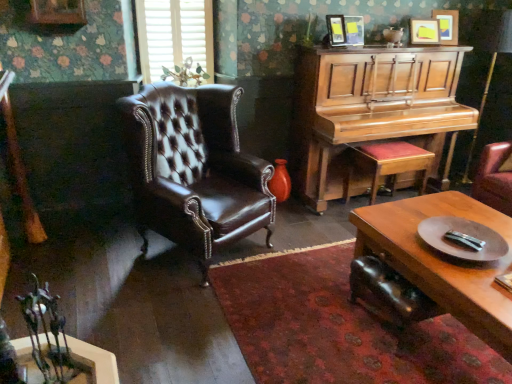
What do you see at coordinates (443, 260) in the screenshot?
I see `wooden polished coffee table at lower right` at bounding box center [443, 260].

Image resolution: width=512 pixels, height=384 pixels. What do you see at coordinates (447, 25) in the screenshot?
I see `matte wooden picture frame at upper right, the fourth picture frame positioned from the left` at bounding box center [447, 25].

Locate an element on the screen. matte wooden picture frame at upper right, which is the 1th picture frame from right to left is located at coordinates (447, 25).

What is the approximate width of wooden polished round table at lower right?

wooden polished round table at lower right is 16.28 inches in width.

Where is `brown leather chair at left`? brown leather chair at left is located at coordinates (194, 169).

Where is `coffee table to the left of wooden picture frame at upper right, the 3th picture frame from the left`? The width and height of the screenshot is (512, 384). coffee table to the left of wooden picture frame at upper right, the 3th picture frame from the left is located at coordinates (443, 260).

From the picture: From a real-world perspective, between wooden polished coffee table at lower right and wooden picture frame at upper right, the 2th picture frame in the right-to-left sequence, who is vertically lower?

wooden polished coffee table at lower right, from a real-world perspective.

Relative to wooden picture frame at upper right, the 2th picture frame in the right-to-left sequence, is wooden polished coffee table at lower right in front or behind?

wooden polished coffee table at lower right is positioned closer to the viewer than wooden picture frame at upper right, the 2th picture frame in the right-to-left sequence.

Considering the sizes of wooden polished coffee table at lower right and wooden picture frame at upper right, the 2th picture frame in the right-to-left sequence, in the image, is wooden polished coffee table at lower right taller or shorter than wooden picture frame at upper right, the 2th picture frame in the right-to-left sequence,?

In the image, wooden polished coffee table at lower right appears to be taller than wooden picture frame at upper right, the 2th picture frame in the right-to-left sequence.

Identify the location of picture frame that is the 2nd one when counting rightward from the wooden polished round table at lower right. tap(447, 25).

From a real-world perspective, is matte wooden picture frame at upper right, the fourth picture frame positioned from the left, above or below wooden polished round table at lower right?

matte wooden picture frame at upper right, the fourth picture frame positioned from the left, is situated higher than wooden polished round table at lower right in the real world.

Is point (442, 10) farther from viewer compared to point (446, 242)?

Yes, point (442, 10) is behind point (446, 242).

Relative to wooden stool with red cushion at right, is matte wooden picture frame at upper center, acting as the second picture frame starting from the left, in front or behind?

In the image, matte wooden picture frame at upper center, acting as the second picture frame starting from the left, appears behind wooden stool with red cushion at right.

Is matte wooden picture frame at upper center, acting as the second picture frame starting from the left, situated inside wooden stool with red cushion at right or outside?

matte wooden picture frame at upper center, acting as the second picture frame starting from the left, is not enclosed by wooden stool with red cushion at right.

From the image's perspective, is matte wooden picture frame at upper center, acting as the third picture frame starting from the right, located above wooden stool with red cushion at right?

Indeed, from the image's perspective, matte wooden picture frame at upper center, acting as the third picture frame starting from the right, is shown above wooden stool with red cushion at right.

From a real-world perspective, is matte wooden picture frame at upper center, acting as the second picture frame starting from the left, located higher than wooden polished coffee table at lower right?

Yes, from a real-world perspective, matte wooden picture frame at upper center, acting as the second picture frame starting from the left, is over wooden polished coffee table at lower right

Could you tell me if matte wooden picture frame at upper center, acting as the second picture frame starting from the left, is turned towards wooden polished coffee table at lower right?

No, matte wooden picture frame at upper center, acting as the second picture frame starting from the left, is not aimed at wooden polished coffee table at lower right.

Which of these two, matte wooden picture frame at upper center, acting as the second picture frame starting from the left, or wooden polished coffee table at lower right, stands taller?

wooden polished coffee table at lower right is taller.

Is matte wooden picture frame at upper center, acting as the third picture frame starting from the right, next to wooden polished coffee table at lower right?

No, matte wooden picture frame at upper center, acting as the third picture frame starting from the right, is not in contact with wooden polished coffee table at lower right.

From the image's perspective, between white matte blinds at upper left and brown leather chair at left, who is located below?

brown leather chair at left, from the image's perspective.

Does white matte blinds at upper left have a lesser height compared to brown leather chair at left?

Correct, white matte blinds at upper left is not as tall as brown leather chair at left.

Does white matte blinds at upper left have a larger size compared to brown leather chair at left?

Incorrect, white matte blinds at upper left is not larger than brown leather chair at left.

Is wooden polished coffee table at lower right to the left of wooden piano at right from the viewer's perspective?

No, wooden polished coffee table at lower right is not to the left of wooden piano at right.

From the image's perspective, is wooden polished coffee table at lower right located above wooden piano at right?

No, from the image's perspective, wooden polished coffee table at lower right is not over wooden piano at right.

Choose the correct answer: Is wooden polished coffee table at lower right inside wooden piano at right or outside it?

wooden polished coffee table at lower right is located beyond the bounds of wooden piano at right.

Which is closer, (490, 286) or (352, 69)?

The point (490, 286) is more forward.

Can you confirm if matte wooden picture frame at upper right, which is the 1th picture frame from right to left, is wider than matte wooden picture frame at upper center, acting as the third picture frame starting from the right?

In fact, matte wooden picture frame at upper right, which is the 1th picture frame from right to left, might be narrower than matte wooden picture frame at upper center, acting as the third picture frame starting from the right.

Is matte wooden picture frame at upper right, which is the 1th picture frame from right to left, not inside matte wooden picture frame at upper center, acting as the third picture frame starting from the right?

matte wooden picture frame at upper right, which is the 1th picture frame from right to left, lies outside matte wooden picture frame at upper center, acting as the third picture frame starting from the right,'s area.

Are matte wooden picture frame at upper right, the fourth picture frame positioned from the left, and matte wooden picture frame at upper center, acting as the third picture frame starting from the right, located far from each other?

That's not correct — matte wooden picture frame at upper right, the fourth picture frame positioned from the left, is a little close to matte wooden picture frame at upper center, acting as the third picture frame starting from the right.

Image resolution: width=512 pixels, height=384 pixels. Identify the location of the 2nd picture frame behind the matte wooden picture frame at upper center, acting as the third picture frame starting from the right, counting from the anchor's position. (447, 25).

Find the location of a particular element. This screenshot has height=384, width=512. the 3rd picture frame positioned above the wooden polished coffee table at lower right (from a real-world perspective) is located at coordinates (424, 31).

Where is `round table below the matte wooden picture frame at upper right, the fourth picture frame positioned from the left (from a real-world perspective)`? This screenshot has width=512, height=384. round table below the matte wooden picture frame at upper right, the fourth picture frame positioned from the left (from a real-world perspective) is located at coordinates (462, 239).

Which object lies further to the anchor point wooden picture frame at upper right, the 3th picture frame from the left, white matte blinds at upper left or brown leather chair at left?

brown leather chair at left is further to wooden picture frame at upper right, the 3th picture frame from the left.

In the scene shown: Based on their spatial positions, is wooden polished coffee table at lower right or white matte blinds at upper left closer to matte wooden picture frame at upper center, acting as the third picture frame starting from the right?

white matte blinds at upper left lies closer to matte wooden picture frame at upper center, acting as the third picture frame starting from the right, than the other object.

Looking at this image, when comparing their distances from wooden piano at right, does wooden polished round table at lower right or brown leather chair at left seem closer?

brown leather chair at left.

Estimate the real-world distances between objects in this image. Which object is further from wooden picture frame at upper right, the 3th picture frame from the left, matte wooden picture frame at upper right, which is the 1th picture frame from right to left, or wooden piano at right?

wooden piano at right is positioned further to the anchor wooden picture frame at upper right, the 3th picture frame from the left.

Looking at the image, which one is located closer to wooden polished round table at lower right, brown leather chair at left or wooden piano at right?

Based on the image, wooden piano at right appears to be nearer to wooden polished round table at lower right.

Which object lies nearer to the anchor point brown leather chair at left, wooden polished round table at lower right or wooden picture frame at upper right, the 3th picture frame from the left?

wooden polished round table at lower right.

Looking at the image, which one is located closer to matte wooden picture frame at upper center, acting as the second picture frame starting from the left, matte wooden picture frame at upper right, which is the 1th picture frame from right to left, or wooden polished round table at lower right?

matte wooden picture frame at upper right, which is the 1th picture frame from right to left, lies closer to matte wooden picture frame at upper center, acting as the second picture frame starting from the left, than the other object.

Looking at the image, which one is located further to wooden stool with red cushion at right, wooden picture frame at upper right, placed as the fourth picture frame when sorted from right to left, or matte wooden picture frame at upper right, which is the 1th picture frame from right to left?

Based on the image, matte wooden picture frame at upper right, which is the 1th picture frame from right to left, appears to be further to wooden stool with red cushion at right.

Image resolution: width=512 pixels, height=384 pixels. I want to click on cabinetry between wooden picture frame at upper right, marked as the 1th picture frame in a left-to-right arrangement, and wooden stool with red cushion at right in the up-down direction, so click(375, 117).

The width and height of the screenshot is (512, 384). I want to click on round table situated between brown leather chair at left and wooden stool with red cushion at right from left to right, so click(x=462, y=239).

Where is `stool between wooden polished round table at lower right and wooden picture frame at upper right, the 2th picture frame in the right-to-left sequence, along the z-axis`? stool between wooden polished round table at lower right and wooden picture frame at upper right, the 2th picture frame in the right-to-left sequence, along the z-axis is located at coordinates (387, 164).

This screenshot has width=512, height=384. I want to click on coffee table situated between white matte blinds at upper left and matte wooden picture frame at upper right, the fourth picture frame positioned from the left, from left to right, so (x=443, y=260).